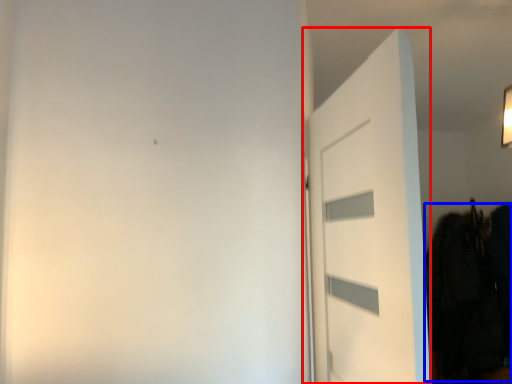
Question: Which of the following is the farthest to the observer, door (highlighted by a red box) or clothing (highlighted by a blue box)?

Choices:
 (A) door
 (B) clothing

Answer: (B)